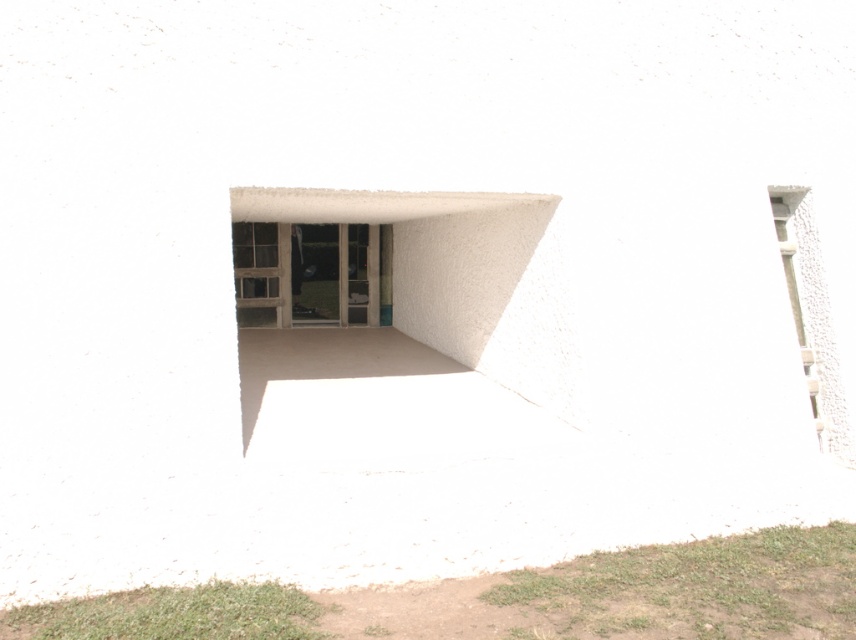
Who is positioned more to the left, transparent glass window at center or smooth concrete window at right?

Positioned to the left is transparent glass window at center.

Between point (321, 324) and point (776, 209), which one is positioned in front?

Point (776, 209) is more forward.

Where is `transparent glass window at center`? transparent glass window at center is located at coordinates (306, 273).